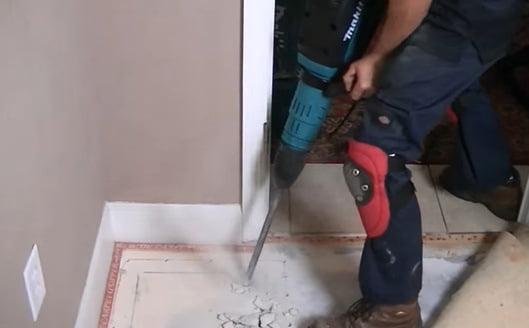
At what (x,y) coordinates should I click in order to perform the action: click on baseboard. Please return your answer as a coordinate pair (x, y). This screenshot has width=529, height=328. Looking at the image, I should click on (183, 223), (90, 298).